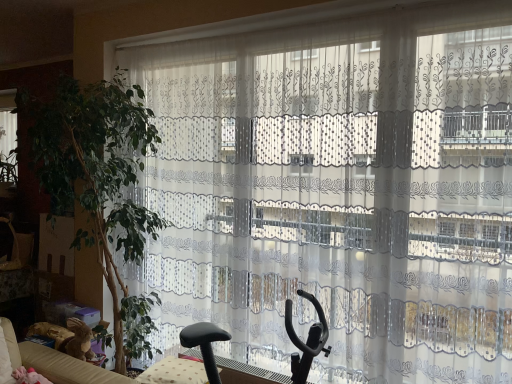
Question: Considering the relative positions of green leafy plant at left and transparent lace curtain at left in the image provided, is green leafy plant at left in front of transparent lace curtain at left?

Choices:
 (A) no
 (B) yes

Answer: (B)

Question: Is green leafy plant at left shorter than transparent lace curtain at left?

Choices:
 (A) no
 (B) yes

Answer: (A)

Question: From the image's perspective, is green leafy plant at left located beneath transparent lace curtain at left?

Choices:
 (A) yes
 (B) no

Answer: (A)

Question: Is green leafy plant at left oriented away from transparent lace curtain at left?

Choices:
 (A) yes
 (B) no

Answer: (B)

Question: Does green leafy plant at left come behind transparent lace curtain at left?

Choices:
 (A) no
 (B) yes

Answer: (A)

Question: Based on their sizes in the image, would you say green leafy plant at left is bigger or smaller than transparent lace curtain at left?

Choices:
 (A) small
 (B) big

Answer: (B)

Question: Is green leafy plant at left to the left or to the right of transparent lace curtain at left in the image?

Choices:
 (A) left
 (B) right

Answer: (B)

Question: From their relative heights in the image, would you say green leafy plant at left is taller or shorter than transparent lace curtain at left?

Choices:
 (A) short
 (B) tall

Answer: (B)

Question: Is green leafy plant at left in front of or behind transparent lace curtain at left in the image?

Choices:
 (A) front
 (B) behind

Answer: (A)

Question: Considering the positions of green leafy plant at left and black plastic swivel chair at center in the image, is green leafy plant at left taller or shorter than black plastic swivel chair at center?

Choices:
 (A) short
 (B) tall

Answer: (B)

Question: From the image's perspective, is green leafy plant at left positioned above or below black plastic swivel chair at center?

Choices:
 (A) above
 (B) below

Answer: (A)

Question: Choose the correct answer: Is green leafy plant at left inside black plastic swivel chair at center or outside it?

Choices:
 (A) inside
 (B) outside

Answer: (B)

Question: Considering their positions, is green leafy plant at left located in front of or behind black plastic swivel chair at center?

Choices:
 (A) front
 (B) behind

Answer: (B)

Question: Is black plastic swivel chair at center in front of or behind green leafy plant at left in the image?

Choices:
 (A) front
 (B) behind

Answer: (A)

Question: From the image's perspective, is black plastic swivel chair at center above or below green leafy plant at left?

Choices:
 (A) above
 (B) below

Answer: (B)